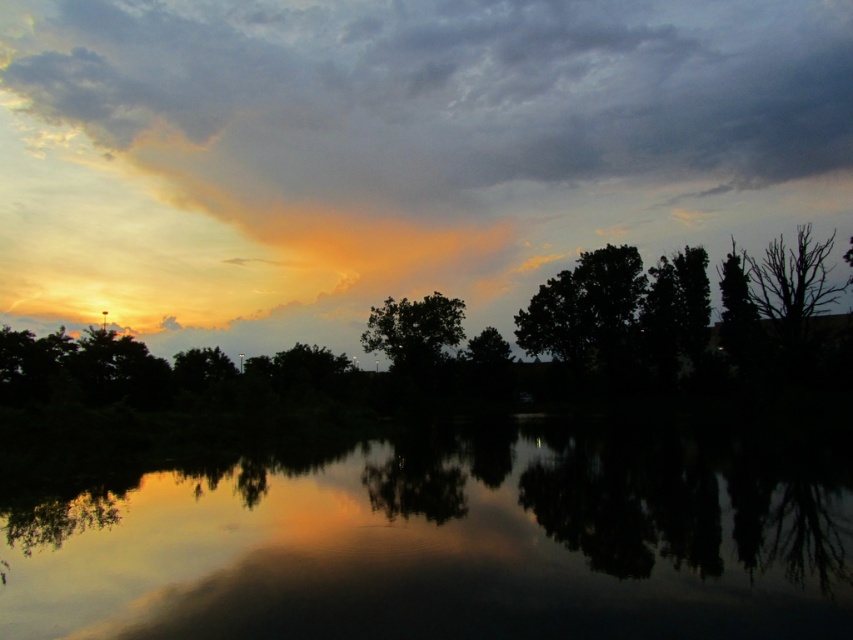
Question: Can you confirm if reflective dark water at center is positioned below green leafy tree at center?

Choices:
 (A) yes
 (B) no

Answer: (A)

Question: Estimate the real-world distances between objects in this image. Which object is closer to the green matte tree at center?

Choices:
 (A) orange translucent cloud at upper center
 (B) reflective dark water at center

Answer: (B)

Question: Which point appears farthest from the camera in this image?

Choices:
 (A) (126, 173)
 (B) (698, 429)
 (C) (440, 344)

Answer: (A)

Question: In this image, where is orange translucent cloud at upper center located relative to reflective dark water at center?

Choices:
 (A) below
 (B) above

Answer: (B)

Question: Which point is closer to the camera?

Choices:
 (A) green matte tree at center
 (B) reflective dark water at center
 (C) green leafy tree at center

Answer: (B)

Question: Can you confirm if orange translucent cloud at upper center is positioned below green matte tree at center?

Choices:
 (A) no
 (B) yes

Answer: (A)